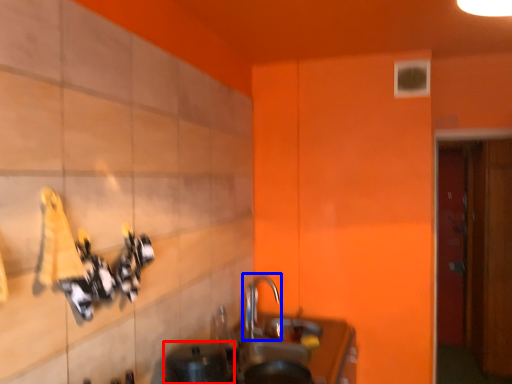
Question: Which of the following is the farthest to the observer, appliance (highlighted by a red box) or tap (highlighted by a blue box)?

Choices:
 (A) appliance
 (B) tap

Answer: (B)